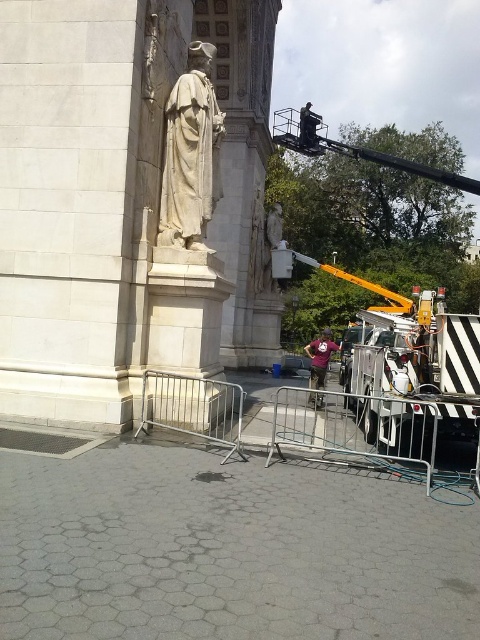
This screenshot has height=640, width=480. Describe the element at coordinates (191, 154) in the screenshot. I see `white marble statue at upper left` at that location.

Between white marble statue at upper left and purple fabric construction worker at center, which one is positioned lower?

purple fabric construction worker at center is lower down.

Measure the distance between point (210,104) and camera.

They are 9.50 meters apart.

Where is `white marble statue at upper left`? This screenshot has width=480, height=640. white marble statue at upper left is located at coordinates (191, 154).